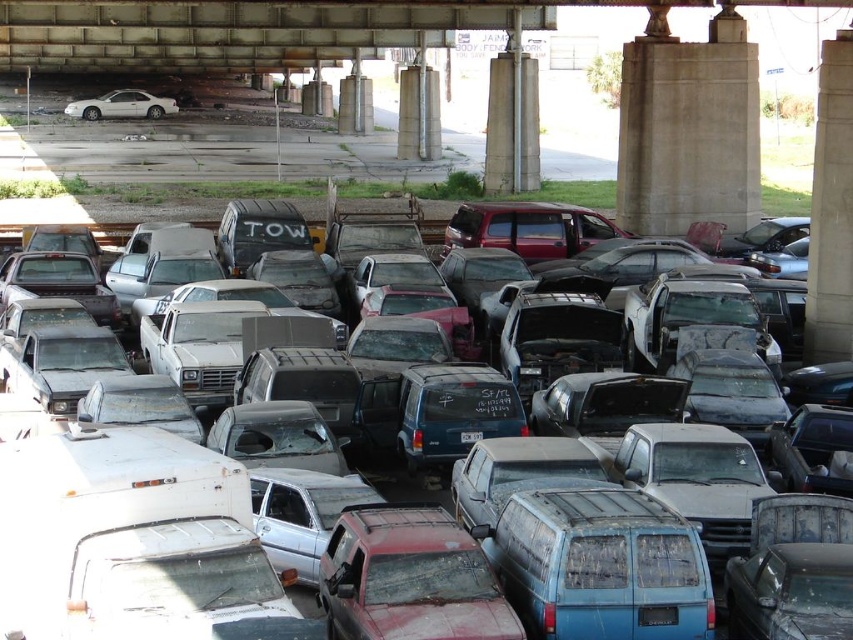
Question: Which point is farther to the camera?

Choices:
 (A) white plastic license plate at center
 (B) white glossy sedan at upper left

Answer: (B)

Question: Which of these objects is positioned farthest from the white plastic license plate at center?

Choices:
 (A) white glossy sedan at upper left
 (B) rusty metal truck at center

Answer: (A)

Question: Among these objects, which one is farthest from the camera?

Choices:
 (A) white plastic license plate at center
 (B) white glossy sedan at upper left

Answer: (B)

Question: Does rusty metal truck at center have a larger size compared to white plastic license plate at center?

Choices:
 (A) no
 (B) yes

Answer: (B)

Question: Does rusty metal truck at center have a smaller size compared to white glossy sedan at upper left?

Choices:
 (A) yes
 (B) no

Answer: (B)

Question: Is rusty metal truck at center thinner than white plastic license plate at center?

Choices:
 (A) no
 (B) yes

Answer: (A)